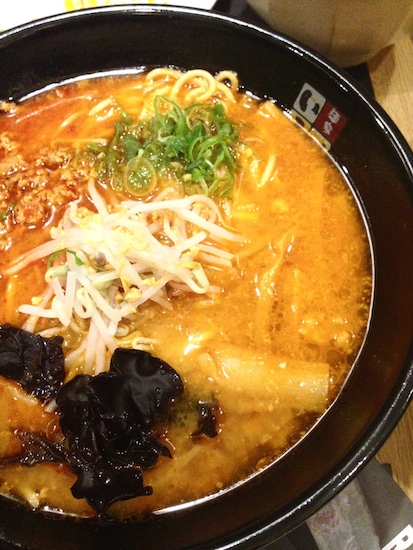
I want to click on black napkin on table, so click(380, 493), click(388, 516), click(289, 544), click(355, 70).